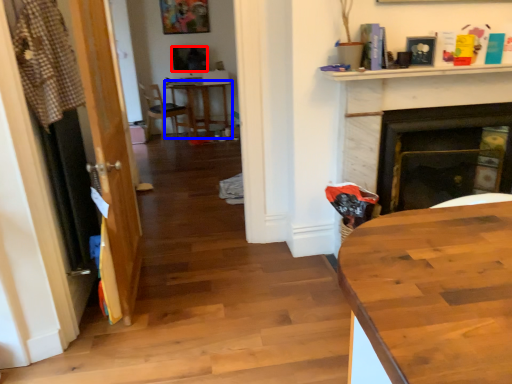
Question: Which object is closer to the camera taking this photo, television (highlighted by a red box) or round table (highlighted by a blue box)?

Choices:
 (A) television
 (B) round table

Answer: (B)